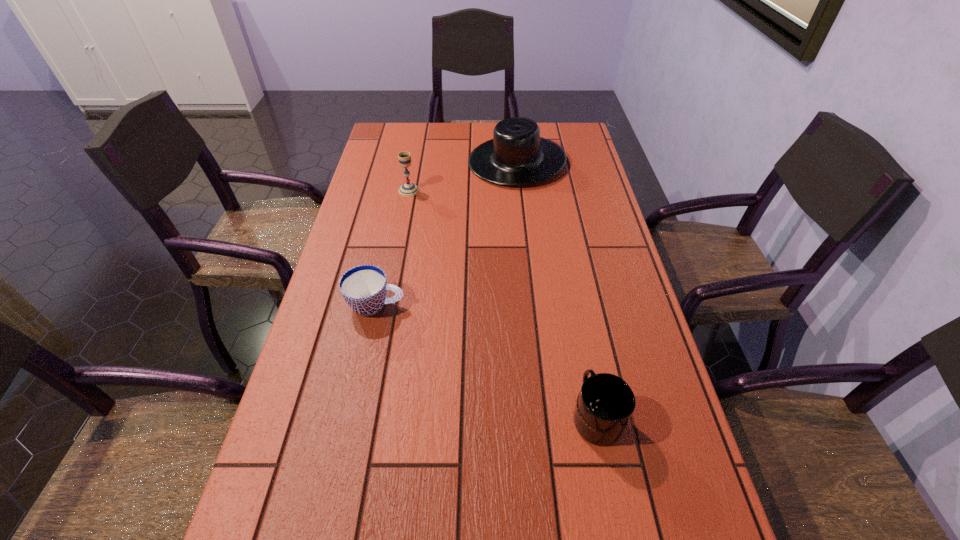
The image size is (960, 540). Identify the location of vacant space at the right edge of the desktop. (601, 238).

What are the coordinates of `vacant region at the far right corner of the desktop` in the screenshot? It's located at (579, 142).

The image size is (960, 540). In order to click on empty space that is in between the shortest object and the chalice in this screenshot , I will do `click(393, 248)`.

Where is `vacant area that lies between the second shortest object and the dress hat`? vacant area that lies between the second shortest object and the dress hat is located at coordinates (556, 288).

Identify the location of free space between the shortest object and the dress hat. (446, 233).

Where is `free space between the dress hat and the chalice`? The image size is (960, 540). free space between the dress hat and the chalice is located at coordinates (463, 176).

Locate an element on the screen. free spot between the chalice and the dress hat is located at coordinates (463, 176).

Locate an element on the screen. The height and width of the screenshot is (540, 960). vacant space that is in between the mug and the cup is located at coordinates (486, 360).

Identify the location of free spot between the chalice and the nearest object. The image size is (960, 540). (502, 303).

Locate an element on the screen. Image resolution: width=960 pixels, height=540 pixels. blank region between the chalice and the third farthest object is located at coordinates (393, 248).